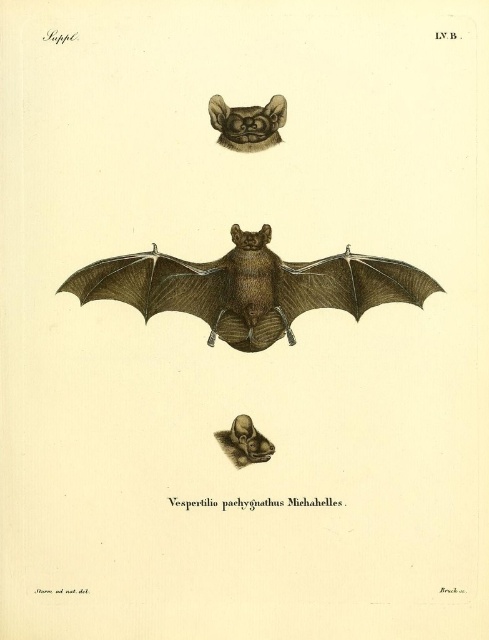
Between point (248, 268) and point (283, 99), which one is positioned behind?

Point (248, 268)

This screenshot has width=489, height=640. In order to click on brown textured bat at center in this screenshot , I will do `click(249, 288)`.